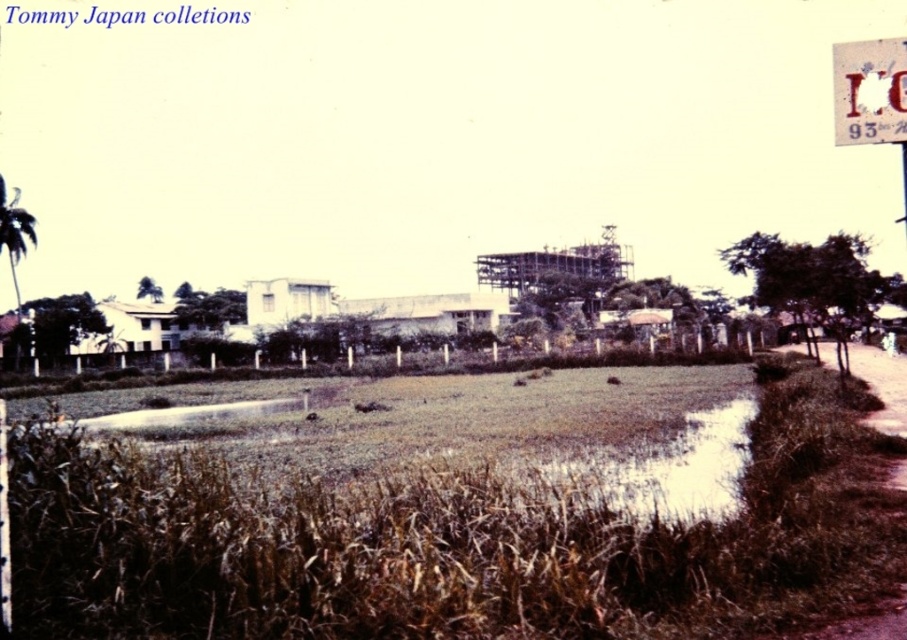
You are standing in the flooded field and want to reach the white building with a flat roof. There is a point marked at coordinates (869, 92) which is the white paper at upper right. Is this point closer to the flooded field or the white building with a flat roof?

The point marked at coordinates (869, 92) corresponds to the white paper at upper right, which is closer to the white building with a flat roof than the flooded field.

Please provide the 2D coordinates of the white paper at upper right in the image, using the coordinate system where the bottom left corner is the origin point.

The 2D coordinates of the white paper at upper right are at point (869, 92).